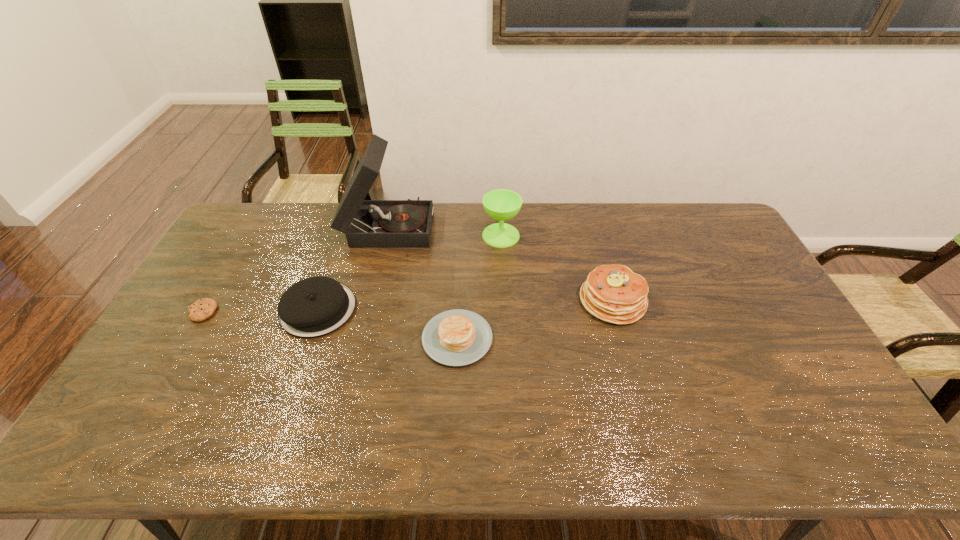
Find the location of a particular element. Image resolution: width=960 pixels, height=540 pixels. the tallest object is located at coordinates (408, 223).

Where is `the fifth shortest object`? The height and width of the screenshot is (540, 960). the fifth shortest object is located at coordinates (501, 204).

Find the location of a particular element. This screenshot has width=960, height=540. the rightmost object is located at coordinates (613, 293).

Locate an element on the screen. The width and height of the screenshot is (960, 540). the tallest pancake is located at coordinates (613, 293).

What are the coordinates of `the leftmost pancake` in the screenshot? It's located at (313, 307).

The height and width of the screenshot is (540, 960). Find the location of `the fourth tallest object`. the fourth tallest object is located at coordinates (313, 307).

Identify the location of the second pancake from left to right. (457, 337).

What are the coordinates of `the shortest pancake` in the screenshot? It's located at (457, 337).

Locate an element on the screen. The height and width of the screenshot is (540, 960). cookie is located at coordinates (202, 309).

This screenshot has width=960, height=540. Identify the location of the shortest object. (202, 309).